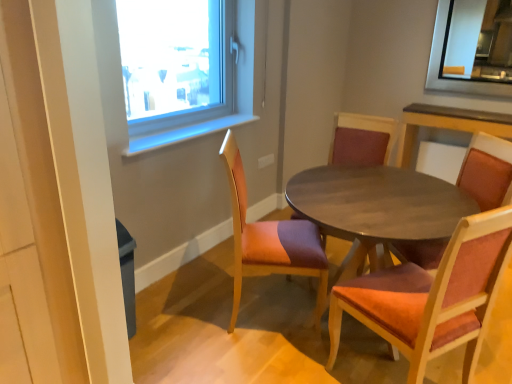
Identify the location of free location to the left of wooden table at center. This screenshot has width=512, height=384. (205, 321).